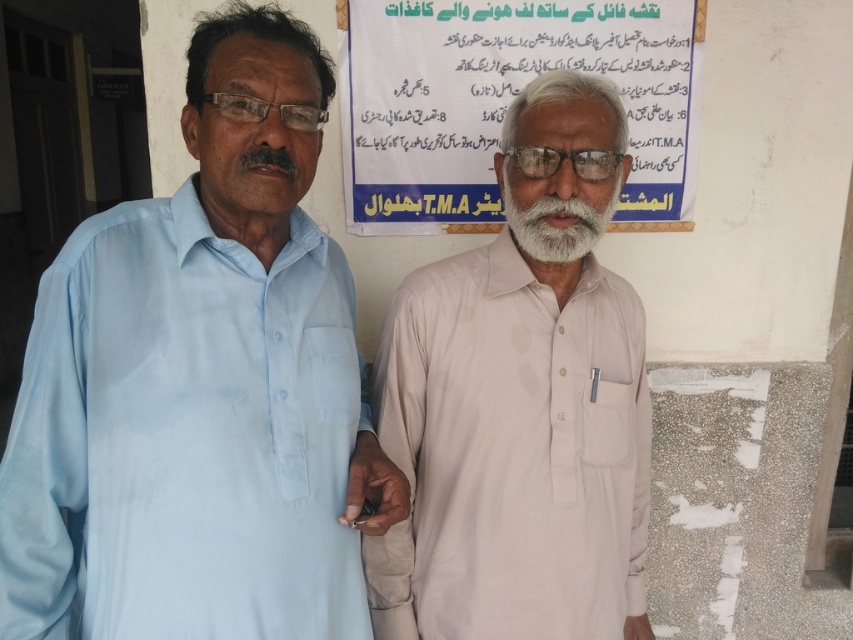
Is point (368, 577) less distant than point (613, 24)?

Yes, point (368, 577) is in front of point (613, 24).

Who is more distant from viewer, [544,136] or [611,1]?

Positioned behind is point [611,1].

Where is `light beige cotton shirt at center`? light beige cotton shirt at center is located at coordinates (521, 403).

In the scene shown: Can you confirm if light blue cotton shirt at left is positioned to the left of light beige cotton shirt at center?

Yes, light blue cotton shirt at left is to the left of light beige cotton shirt at center.

Does light blue cotton shirt at left have a smaller size compared to light beige cotton shirt at center?

No.

Is point (299, 532) farther from viewer compared to point (579, 532)?

No, it is not.

This screenshot has width=853, height=640. In order to click on light blue cotton shirt at left in this screenshot , I will do `click(201, 385)`.

Is point (634, 176) more distant than point (595, 211)?

Yes, point (634, 176) is behind point (595, 211).

Does white paper at upper center come in front of white soft beard at center?

No, white paper at upper center is further to the viewer.

Image resolution: width=853 pixels, height=640 pixels. Find the location of `white paper at upper center`. white paper at upper center is located at coordinates (505, 102).

Identify the location of white paper at upper center. Image resolution: width=853 pixels, height=640 pixels. (505, 102).